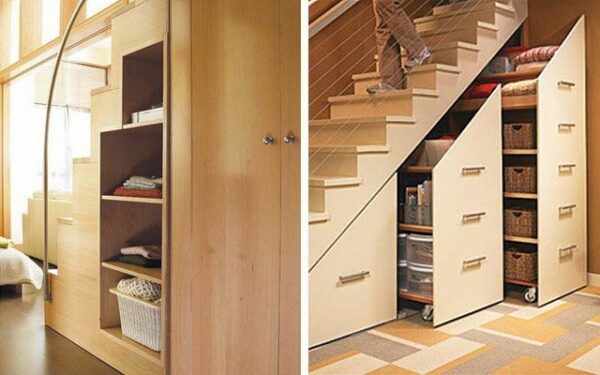
Where is `brown box`? The image size is (600, 375). brown box is located at coordinates (517, 265), (519, 219), (523, 181), (520, 139).